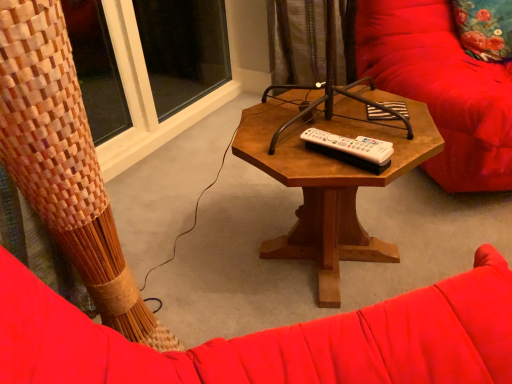
Locate an element on the screen. free space to the back side of white plastic remote at center is located at coordinates (315, 118).